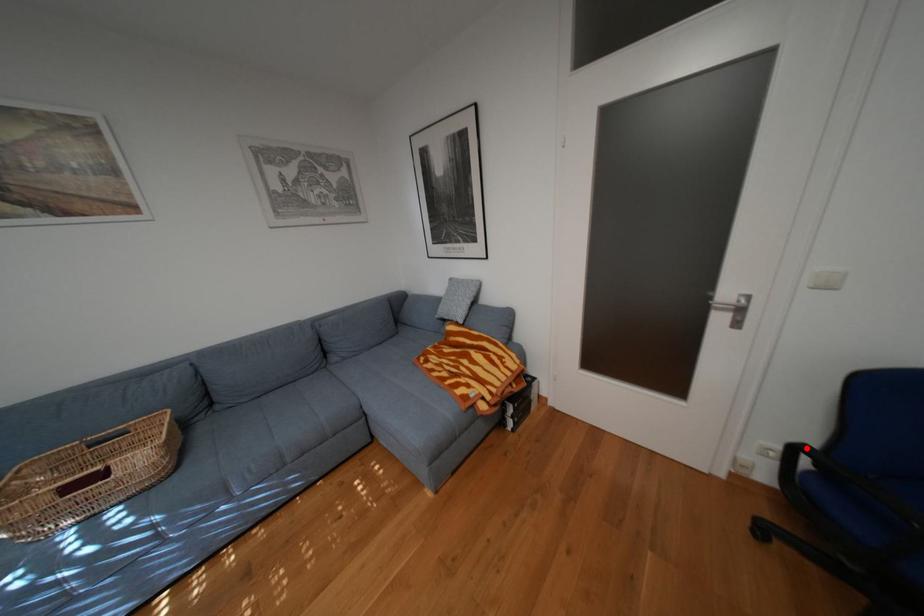
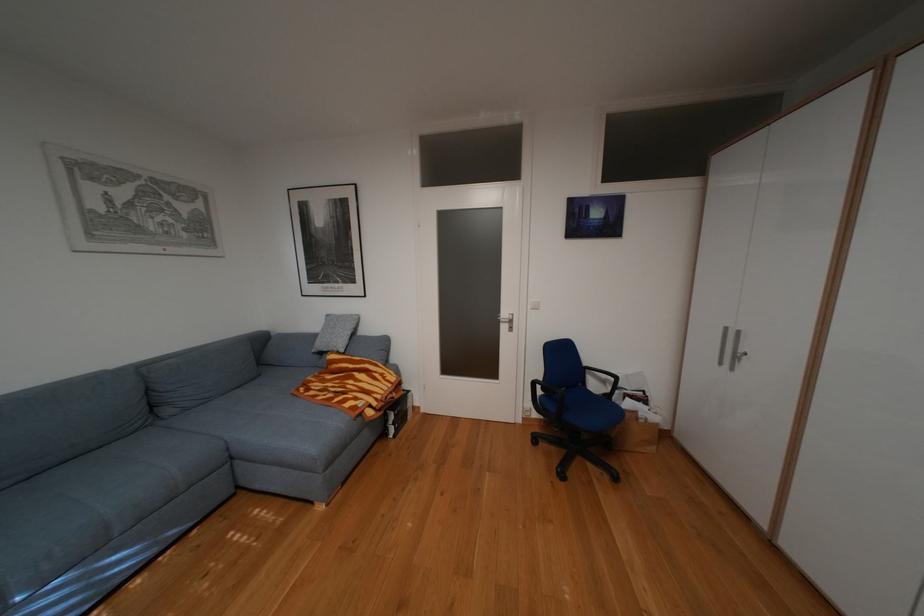
Question: I am providing you with two images of the same scene from different viewpoints. A red point is shown in image1. For the corresponding object point in image2, is it positioned nearer or farther from the camera?

Choices:
 (A) Nearer
 (B) Farther

Answer: (B)